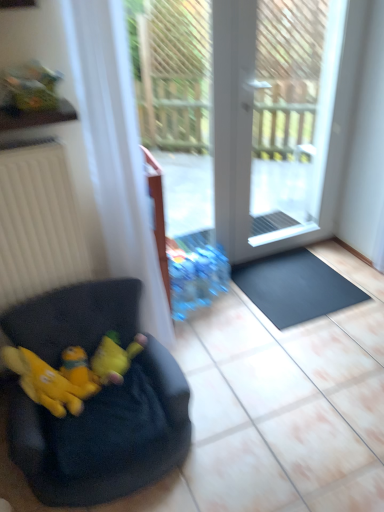
At what (x,y) coordinates should I click in order to perform the action: click on free location to the right of black fabric bean bag at lower left. Please return your answer as a coordinate pair (x, y). The image size is (384, 512). Looking at the image, I should click on (254, 415).